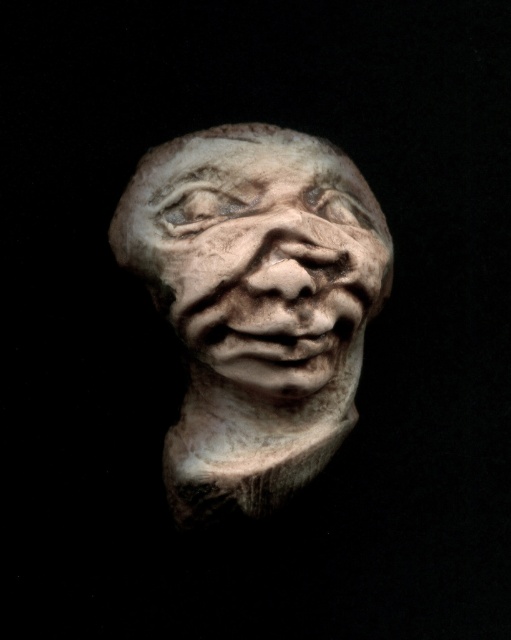
Question: Is white clay bust at center further to camera compared to white stone face at center?

Choices:
 (A) yes
 (B) no

Answer: (A)

Question: Does white clay bust at center appear on the left side of white stone face at center?

Choices:
 (A) yes
 (B) no

Answer: (A)

Question: Which point is closer to the camera taking this photo?

Choices:
 (A) (268, 428)
 (B) (337, 362)

Answer: (A)

Question: Among these points, which one is nearest to the camera?

Choices:
 (A) (352, 288)
 (B) (336, 349)

Answer: (A)

Question: Does white clay bust at center appear on the left side of white stone face at center?

Choices:
 (A) yes
 (B) no

Answer: (A)